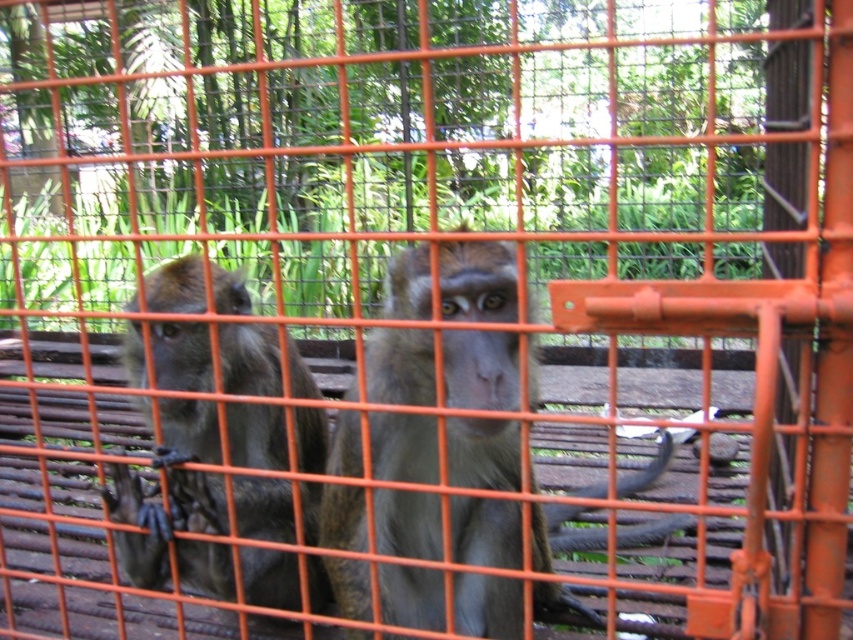
Who is more distant from viewer, (527, 349) or (207, 387)?

The point (207, 387) is more distant.

At what (x,y) coordinates should I click in order to perform the action: click on gray fur monkey at center. Please return your answer as a coordinate pair (x, y). The image size is (853, 640). Looking at the image, I should click on (477, 282).